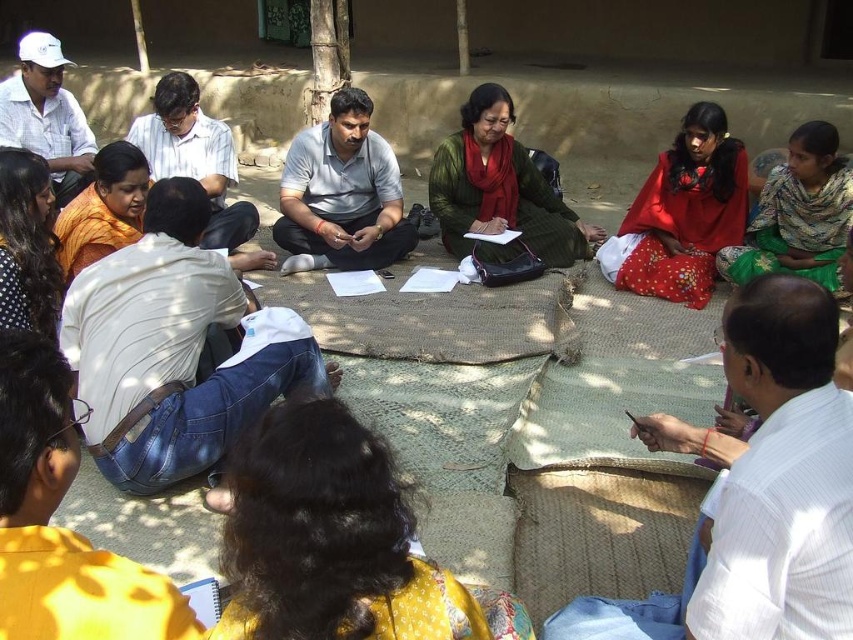
Question: Is the position of light gray cotton shirt at center more distant than that of printed cotton sari at upper right?

Choices:
 (A) yes
 (B) no

Answer: (A)

Question: Is red fabric sari at right positioned before printed cotton sari at upper right?

Choices:
 (A) yes
 (B) no

Answer: (B)

Question: Estimate the real-world distances between objects in this image. Which object is farther from the red fabric sari at right?

Choices:
 (A) printed cotton sari at upper right
 (B) dark brown hair at lower center
 (C) green woolen sweater at center
 (D) light gray cotton shirt at center

Answer: (B)

Question: Which point is farther to the camera?

Choices:
 (A) (722, 272)
 (B) (321, 417)
 (C) (692, 186)

Answer: (C)

Question: Can you confirm if dark brown hair at lower center is thinner than red fabric sari at right?

Choices:
 (A) yes
 (B) no

Answer: (A)

Question: Estimate the real-world distances between objects in this image. Which object is farther from the green woolen sweater at center?

Choices:
 (A) red fabric sari at right
 (B) printed cotton sari at upper right
 (C) dark brown hair at lower center

Answer: (C)